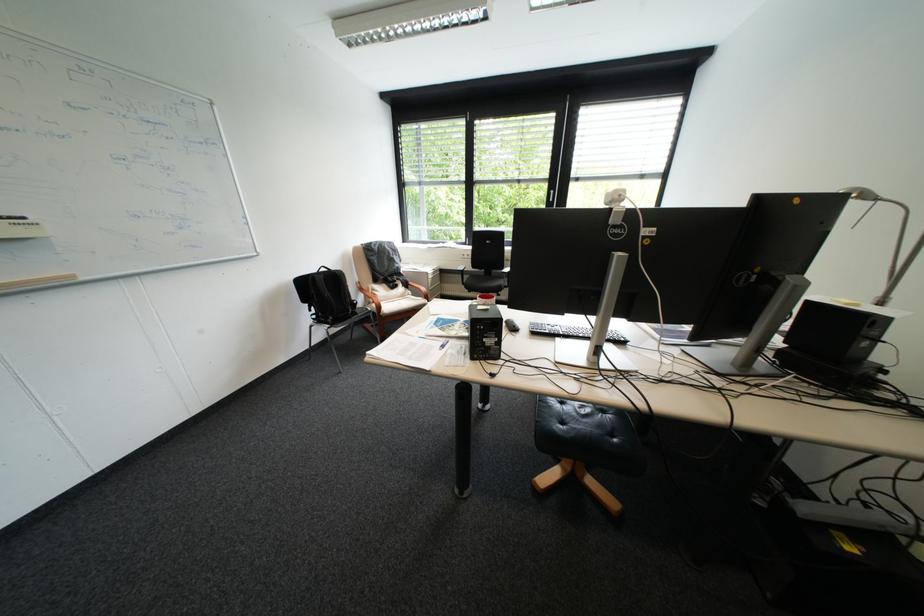
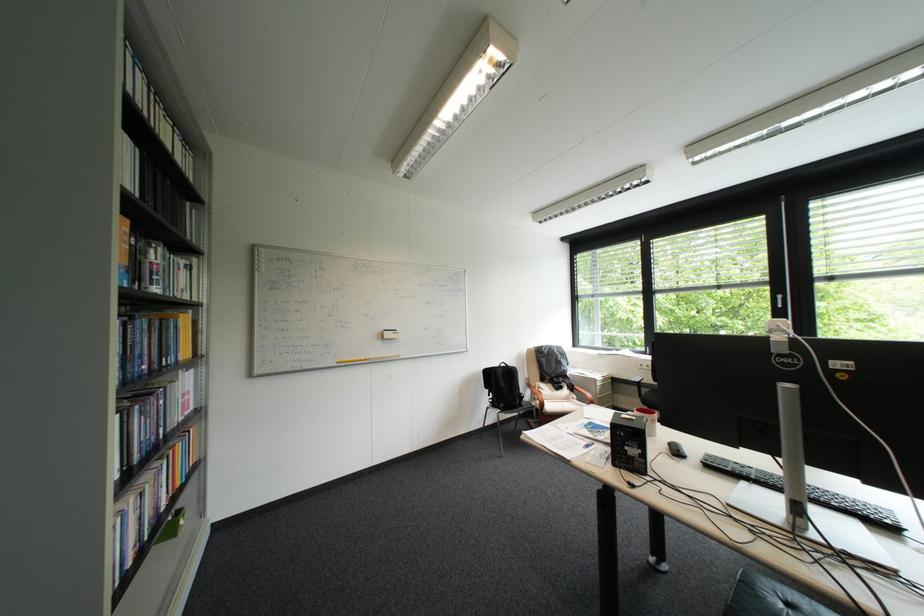
The point at (569, 339) is marked in the first image. Where is the corresponding point in the second image?

(757, 484)